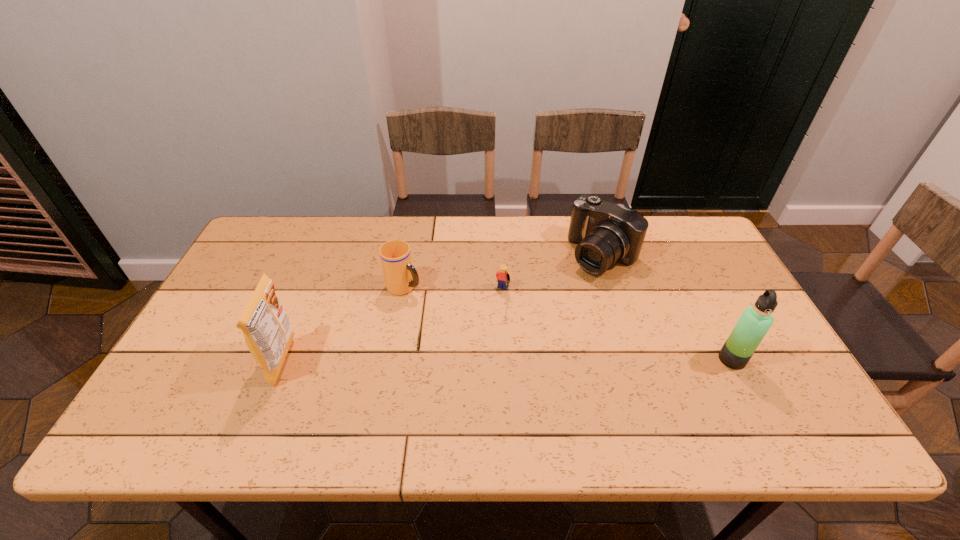
Find the location of `object that is positioned at the near edge`. object that is positioned at the near edge is located at coordinates (266, 327).

Locate an element on the screen. object at the right edge is located at coordinates (755, 321).

At what (x,y) coordinates should I click in order to perform the action: click on vacant area at the far edge. Please return your answer as a coordinate pair (x, y). Looking at the image, I should click on (527, 224).

Identify the location of free space at the near edge. The width and height of the screenshot is (960, 540). (559, 384).

Where is `free space at the left edge of the desktop`? The height and width of the screenshot is (540, 960). free space at the left edge of the desktop is located at coordinates 233,323.

The width and height of the screenshot is (960, 540). Identify the location of vacant space at the right edge. pyautogui.click(x=720, y=274).

Find the location of a particular element. This screenshot has width=960, height=540. vacant region at the far left corner of the desktop is located at coordinates (255, 233).

What are the coordinates of `vacant space at the far right corner of the desktop` in the screenshot? It's located at (687, 247).

Locate an element on the screen. free space that is in between the camera and the leftmost object is located at coordinates (444, 308).

Identify the location of free point between the cup and the thermos bottle. (568, 323).